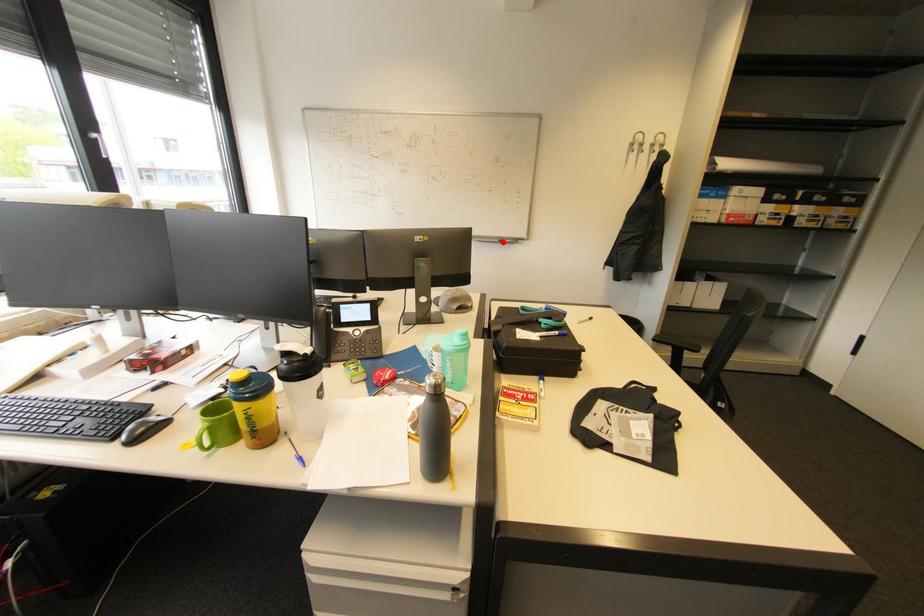
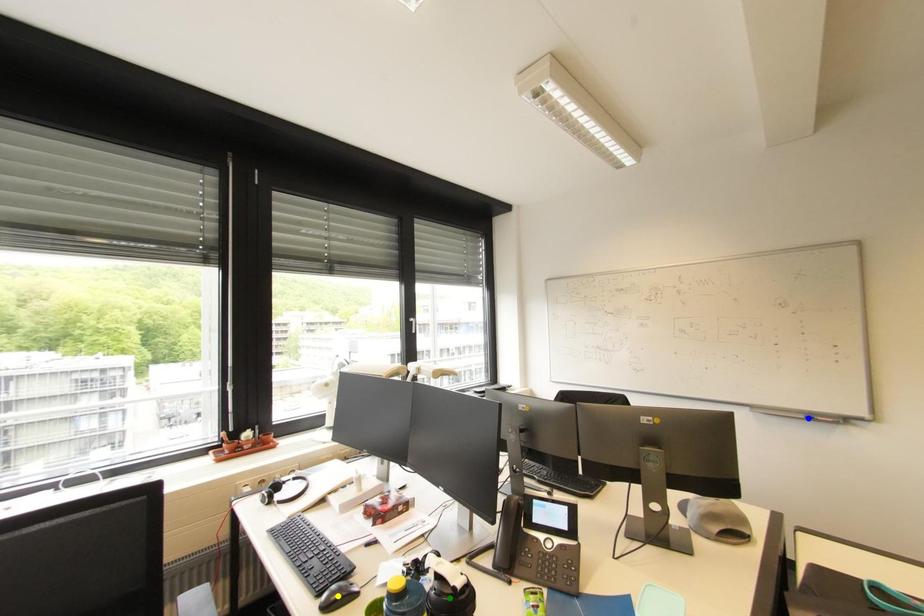
Question: I am providing you with two images of the same scene from different viewpoints. A red point is marked on the first image. You are given multiple points on the second image. Which point in image 2 is actually the same real-world point as the red point in image 1?

Choices:
 (A) blue point
 (B) green point
 (C) yellow point

Answer: (A)